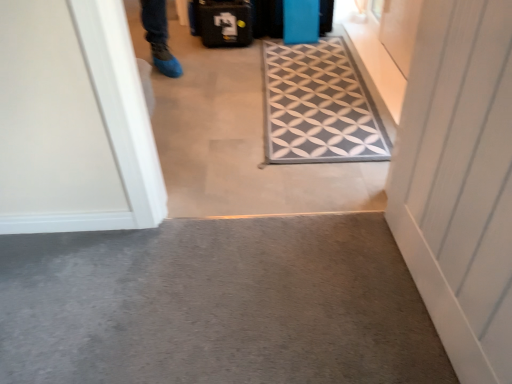
Question: Looking at their shapes, would you say blue matte suitcase at upper center, the second luggage viewed from the left, is wider or thinner than carpeted floor at center?

Choices:
 (A) thin
 (B) wide

Answer: (A)

Question: Is blue matte suitcase at upper center, which is the first luggage in right-to-left order, in front of or behind carpeted floor at center in the image?

Choices:
 (A) behind
 (B) front

Answer: (A)

Question: Which is nearer to the white wood door at right?

Choices:
 (A) black textured suitcase at upper center, which ranks as the 2th luggage in right-to-left order
 (B) blue matte suitcase at upper center, the second luggage viewed from the left
 (C) carpeted floor at center
 (D) gray carpet at lower center
 (E) gray fabric doormat at center

Answer: (D)

Question: Which object is the closest to the white wood door at right?

Choices:
 (A) carpeted floor at center
 (B) gray fabric doormat at center
 (C) gray carpet at lower center
 (D) blue matte suitcase at upper center, the second luggage viewed from the left
 (E) black textured suitcase at upper center, the 1th luggage viewed from the left

Answer: (C)